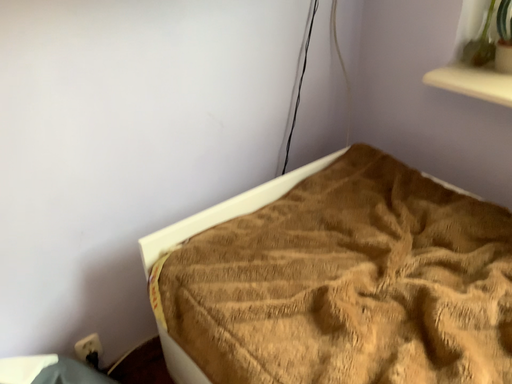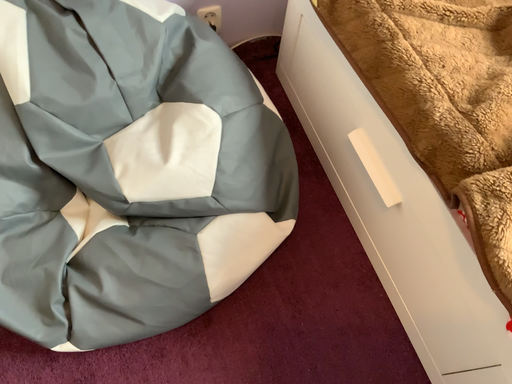
Question: How did the camera likely rotate when shooting the video?

Choices:
 (A) rotated left
 (B) rotated right

Answer: (A)